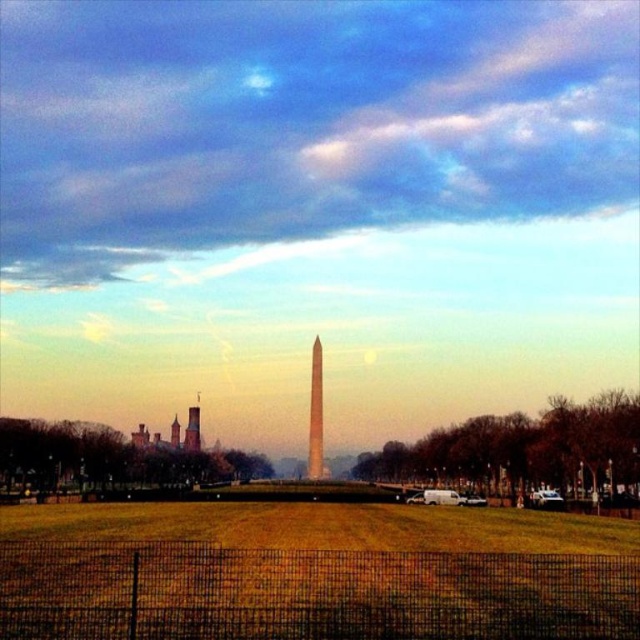
Question: Does yellow grass at center appear under smooth glass obelisk at center?

Choices:
 (A) yes
 (B) no

Answer: (B)

Question: Can you confirm if cloudy sky at upper center is positioned below yellow grass at center?

Choices:
 (A) no
 (B) yes

Answer: (A)

Question: Which point is closer to the camera?

Choices:
 (A) 420,68
 (B) 371,589

Answer: (B)

Question: Is yellow grass at center bigger than smooth glass obelisk at center?

Choices:
 (A) no
 (B) yes

Answer: (B)

Question: Among these objects, which one is nearest to the camera?

Choices:
 (A) yellow grass at center
 (B) cloudy sky at upper center
 (C) smooth glass obelisk at center

Answer: (A)

Question: Which object is the farthest from the yellow grass at center?

Choices:
 (A) smooth glass obelisk at center
 (B) cloudy sky at upper center

Answer: (B)